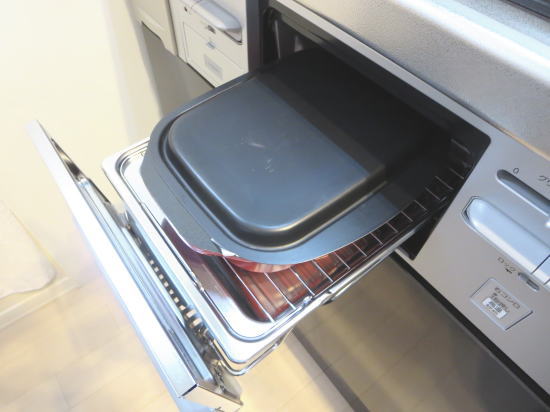
The width and height of the screenshot is (550, 412). What are the coordinates of `cabinet handle` in the screenshot? It's located at (498, 236).